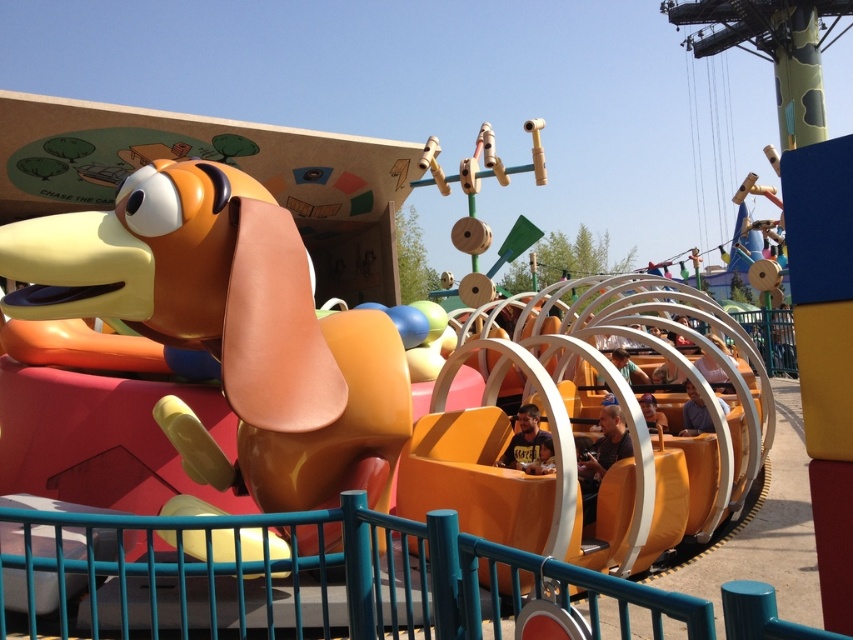
Question: Observing the image, what is the correct spatial positioning of matte yellow helmet at center in reference to matte yellow shirt at center?

Choices:
 (A) left
 (B) right

Answer: (A)

Question: Which point is farther to the camera?

Choices:
 (A) matte yellow helmet at center
 (B) matte yellow shirt at center
 (C) smooth brown hair at center

Answer: (B)

Question: Can you confirm if matte orange shirt at center is wider than pink fabric person at center?

Choices:
 (A) no
 (B) yes

Answer: (A)

Question: Is pink fabric person at center wider than smooth brown hair at center?

Choices:
 (A) yes
 (B) no

Answer: (A)

Question: Which object is closer to the camera taking this photo?

Choices:
 (A) smooth brown hair at center
 (B) matte brown hair at center
 (C) matte yellow shirt at center
 (D) matte orange shirt at center

Answer: (D)

Question: Estimate the real-world distances between objects in this image. Which object is farther from the matte orange dog at left?

Choices:
 (A) pink fabric person at center
 (B) matte yellow shirt at center
 (C) matte orange shirt at center

Answer: (A)